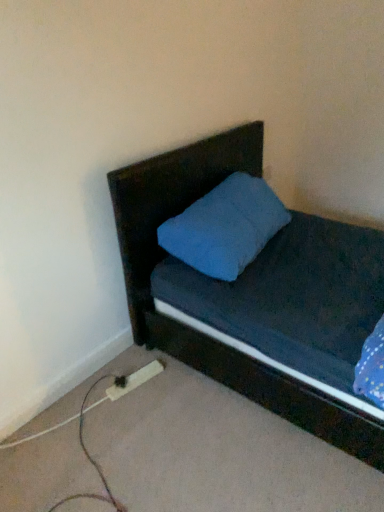
Question: From the image's perspective, is wooden extension cord at lower left under matte dark wood headboard at upper center?

Choices:
 (A) yes
 (B) no

Answer: (A)

Question: Can you confirm if wooden extension cord at lower left is shorter than matte dark wood headboard at upper center?

Choices:
 (A) yes
 (B) no

Answer: (A)

Question: Is wooden extension cord at lower left oriented towards matte dark wood headboard at upper center?

Choices:
 (A) yes
 (B) no

Answer: (B)

Question: Is matte dark wood headboard at upper center at the back of wooden extension cord at lower left?

Choices:
 (A) yes
 (B) no

Answer: (B)

Question: From the image's perspective, does wooden extension cord at lower left appear higher than matte dark wood headboard at upper center?

Choices:
 (A) yes
 (B) no

Answer: (B)

Question: From a real-world perspective, does wooden extension cord at lower left sit lower than matte dark wood headboard at upper center?

Choices:
 (A) yes
 (B) no

Answer: (A)

Question: Considering the relative sizes of matte dark wood headboard at upper center and wooden extension cord at lower left in the image provided, is matte dark wood headboard at upper center thinner than wooden extension cord at lower left?

Choices:
 (A) yes
 (B) no

Answer: (B)

Question: From the image's perspective, is matte dark wood headboard at upper center over wooden extension cord at lower left?

Choices:
 (A) yes
 (B) no

Answer: (A)

Question: Are matte dark wood headboard at upper center and wooden extension cord at lower left beside each other?

Choices:
 (A) yes
 (B) no

Answer: (B)

Question: Considering the relative sizes of matte dark wood headboard at upper center and wooden extension cord at lower left in the image provided, is matte dark wood headboard at upper center smaller than wooden extension cord at lower left?

Choices:
 (A) yes
 (B) no

Answer: (B)

Question: From a real-world perspective, is matte dark wood headboard at upper center on top of wooden extension cord at lower left?

Choices:
 (A) no
 (B) yes

Answer: (B)

Question: Considering the relative sizes of matte dark wood headboard at upper center and wooden extension cord at lower left in the image provided, is matte dark wood headboard at upper center wider than wooden extension cord at lower left?

Choices:
 (A) no
 (B) yes

Answer: (B)

Question: From the image's perspective, is wooden extension cord at lower left positioned above or below matte dark wood headboard at upper center?

Choices:
 (A) below
 (B) above

Answer: (A)